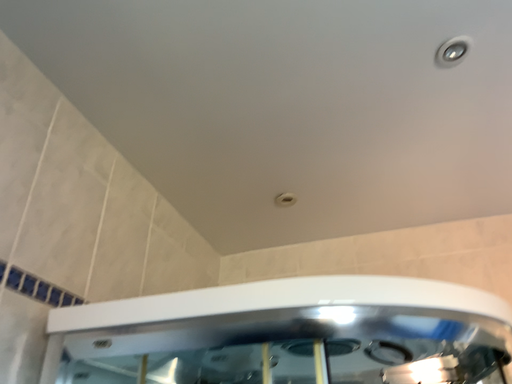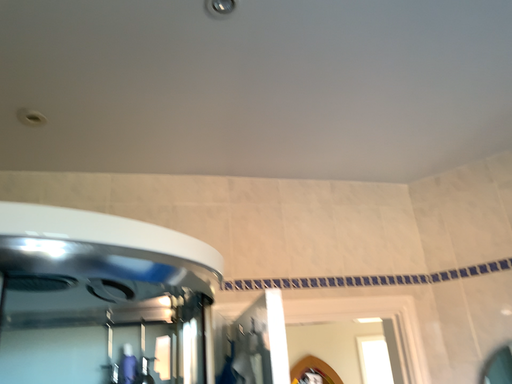
Question: How did the camera likely rotate when shooting the video?

Choices:
 (A) rotated upward
 (B) rotated downward

Answer: (B)